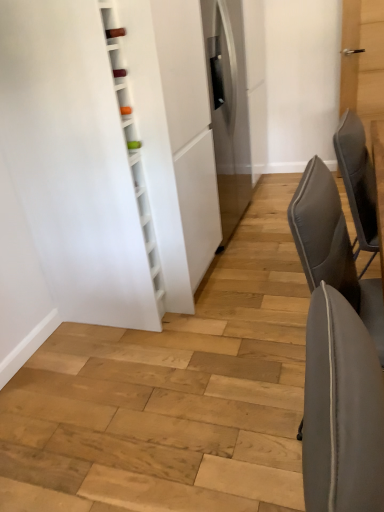
Describe the element at coordinates (358, 182) in the screenshot. Image resolution: width=384 pixels, height=512 pixels. I see `gray fabric chair at right, acting as the 2th chair starting from the bottom` at that location.

Identify the location of gray fabric chair at right, acting as the 2th chair starting from the bottom. The width and height of the screenshot is (384, 512). (358, 182).

Measure the distance between gray fabric chair at right, the first chair when ordered from top to bottom, and camera.

The distance of gray fabric chair at right, the first chair when ordered from top to bottom, from camera is 5.51 feet.

Measure the distance between point (x=335, y=240) and camera.

Point (x=335, y=240) is 3.93 feet away from camera.

Image resolution: width=384 pixels, height=512 pixels. Describe the element at coordinates (332, 248) in the screenshot. I see `gray fabric chair at right, which is the second chair in top-to-bottom order` at that location.

Where is `gray fabric chair at right, acting as the 1th chair starting from the bottom`? The width and height of the screenshot is (384, 512). gray fabric chair at right, acting as the 1th chair starting from the bottom is located at coordinates (332, 248).

I want to click on gray fabric chair at right, the first chair when ordered from top to bottom, so click(358, 182).

Is gray fabric chair at right, which is the second chair in top-to-bottom order, to the right of gray fabric chair at right, acting as the 2th chair starting from the bottom, from the viewer's perspective?

In fact, gray fabric chair at right, which is the second chair in top-to-bottom order, is to the left of gray fabric chair at right, acting as the 2th chair starting from the bottom.

Is the depth of gray fabric chair at right, acting as the 1th chair starting from the bottom, less than that of gray fabric chair at right, the first chair when ordered from top to bottom?

That is True.

Is point (342, 285) closer or farther from the camera than point (360, 129)?

Point (342, 285) appears to be closer to the viewer than point (360, 129).

From the image's perspective, which is below, gray fabric chair at right, acting as the 1th chair starting from the bottom, or gray fabric chair at right, the first chair when ordered from top to bottom?

gray fabric chair at right, acting as the 1th chair starting from the bottom, is shown below in the image.

From a real-world perspective, who is located lower, gray fabric chair at right, acting as the 1th chair starting from the bottom, or gray fabric chair at right, acting as the 2th chair starting from the bottom?

gray fabric chair at right, acting as the 1th chair starting from the bottom, is physically lower.

In terms of width, does gray fabric chair at right, which is the second chair in top-to-bottom order, look wider or thinner when compared to gray fabric chair at right, acting as the 2th chair starting from the bottom?

In the image, gray fabric chair at right, which is the second chair in top-to-bottom order, appears to be wider than gray fabric chair at right, acting as the 2th chair starting from the bottom.

Is gray fabric chair at right, which is the second chair in top-to-bottom order, taller or shorter than gray fabric chair at right, acting as the 2th chair starting from the bottom?

Considering their sizes, gray fabric chair at right, which is the second chair in top-to-bottom order, has more height than gray fabric chair at right, acting as the 2th chair starting from the bottom.

Can you confirm if gray fabric chair at right, acting as the 1th chair starting from the bottom, is smaller than gray fabric chair at right, the first chair when ordered from top to bottom?

Incorrect, gray fabric chair at right, acting as the 1th chair starting from the bottom, is not smaller in size than gray fabric chair at right, the first chair when ordered from top to bottom.

Is gray fabric chair at right, which is the second chair in top-to-bottom order, positioned beyond the bounds of gray fabric chair at right, acting as the 2th chair starting from the bottom?

Yes.

Is gray fabric chair at right, acting as the 1th chair starting from the bottom, next to gray fabric chair at right, acting as the 2th chair starting from the bottom?

gray fabric chair at right, acting as the 1th chair starting from the bottom, and gray fabric chair at right, acting as the 2th chair starting from the bottom, are clearly separated.

Is gray fabric chair at right, acting as the 1th chair starting from the bottom, turned away from gray fabric chair at right, the first chair when ordered from top to bottom?

gray fabric chair at right, acting as the 1th chair starting from the bottom, is not turned away from gray fabric chair at right, the first chair when ordered from top to bottom.

Find the location of a particular element. Image resolution: width=384 pixels, height=512 pixels. chair located in front of the gray fabric chair at right, the first chair when ordered from top to bottom is located at coordinates (332, 248).

Which object is positioned more to the right, gray fabric chair at right, acting as the 2th chair starting from the bottom, or gray fabric chair at right, which is the second chair in top-to-bottom order?

From the viewer's perspective, gray fabric chair at right, acting as the 2th chair starting from the bottom, appears more on the right side.

Is gray fabric chair at right, acting as the 2th chair starting from the bottom, in front of or behind gray fabric chair at right, acting as the 1th chair starting from the bottom, in the image?

gray fabric chair at right, acting as the 2th chair starting from the bottom, is behind gray fabric chair at right, acting as the 1th chair starting from the bottom.

Does point (370, 163) come closer to viewer compared to point (315, 184)?

That is False.

From the image's perspective, would you say gray fabric chair at right, the first chair when ordered from top to bottom, is shown under gray fabric chair at right, which is the second chair in top-to-bottom order?

No.

From a real-world perspective, is gray fabric chair at right, the first chair when ordered from top to bottom, positioned above or below gray fabric chair at right, which is the second chair in top-to-bottom order?

gray fabric chair at right, the first chair when ordered from top to bottom, is situated higher than gray fabric chair at right, which is the second chair in top-to-bottom order, in the real world.

Considering the sizes of gray fabric chair at right, acting as the 2th chair starting from the bottom, and gray fabric chair at right, which is the second chair in top-to-bottom order, in the image, is gray fabric chair at right, acting as the 2th chair starting from the bottom, wider or thinner than gray fabric chair at right, which is the second chair in top-to-bottom order,?

In the image, gray fabric chair at right, acting as the 2th chair starting from the bottom, appears to be more narrow than gray fabric chair at right, which is the second chair in top-to-bottom order.

Which of these two, gray fabric chair at right, acting as the 2th chair starting from the bottom, or gray fabric chair at right, acting as the 1th chair starting from the bottom, stands taller?

Standing taller between the two is gray fabric chair at right, acting as the 1th chair starting from the bottom.

Is gray fabric chair at right, acting as the 2th chair starting from the bottom, bigger or smaller than gray fabric chair at right, which is the second chair in top-to-bottom order?

gray fabric chair at right, acting as the 2th chair starting from the bottom, is smaller than gray fabric chair at right, which is the second chair in top-to-bottom order.

Can gray fabric chair at right, acting as the 1th chair starting from the bottom, be found inside gray fabric chair at right, acting as the 2th chair starting from the bottom?

Definitely not — gray fabric chair at right, acting as the 1th chair starting from the bottom, is not inside gray fabric chair at right, acting as the 2th chair starting from the bottom.

Is gray fabric chair at right, acting as the 2th chair starting from the bottom, not close to gray fabric chair at right, which is the second chair in top-to-bottom order?

No, gray fabric chair at right, acting as the 2th chair starting from the bottom, is not far away from gray fabric chair at right, which is the second chair in top-to-bottom order.

Could you tell me if gray fabric chair at right, the first chair when ordered from top to bottom, is facing gray fabric chair at right, which is the second chair in top-to-bottom order?

No, gray fabric chair at right, the first chair when ordered from top to bottom, is not facing towards gray fabric chair at right, which is the second chair in top-to-bottom order.

Identify the location of chair on the left side of gray fabric chair at right, acting as the 2th chair starting from the bottom. (332, 248).

Locate an element on the screen. chair above the gray fabric chair at right, which is the second chair in top-to-bottom order (from a real-world perspective) is located at coordinates (358, 182).

This screenshot has height=512, width=384. Find the location of `chair below the gray fabric chair at right, acting as the 2th chair starting from the bottom (from a real-world perspective)`. chair below the gray fabric chair at right, acting as the 2th chair starting from the bottom (from a real-world perspective) is located at coordinates (332, 248).